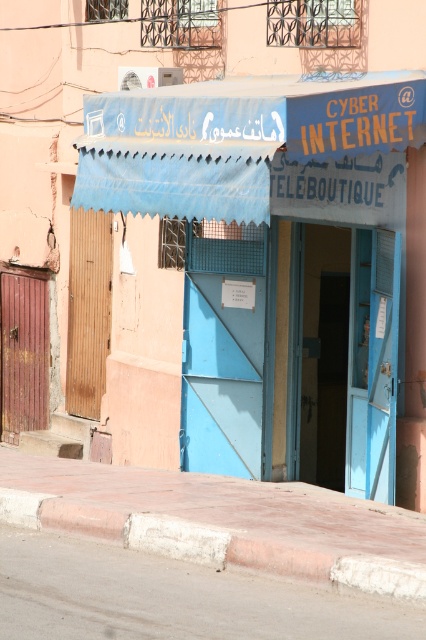
Question: Among these objects, which one is nearest to the camera?

Choices:
 (A) blue painted door at center
 (B) blue fabric canopy at upper center
 (C) concrete at lower center

Answer: (C)

Question: Is blue painted door at center bigger than concrete at lower center?

Choices:
 (A) yes
 (B) no

Answer: (A)

Question: Which point is closer to the camera?

Choices:
 (A) blue painted door at center
 (B) concrete at lower center
 (C) blue fabric canopy at upper center

Answer: (B)

Question: Can you confirm if blue painted door at center is wider than concrete at lower center?

Choices:
 (A) yes
 (B) no

Answer: (A)

Question: Based on their relative distances, which object is farther from the blue painted door at center?

Choices:
 (A) blue fabric canopy at upper center
 (B) concrete at lower center

Answer: (B)

Question: Is blue painted door at center further to camera compared to concrete at lower center?

Choices:
 (A) no
 (B) yes

Answer: (B)